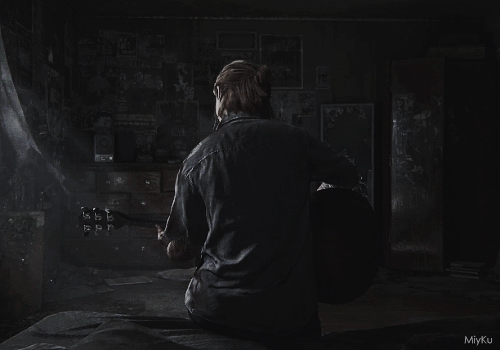
I want to click on doorway, so click(476, 168).